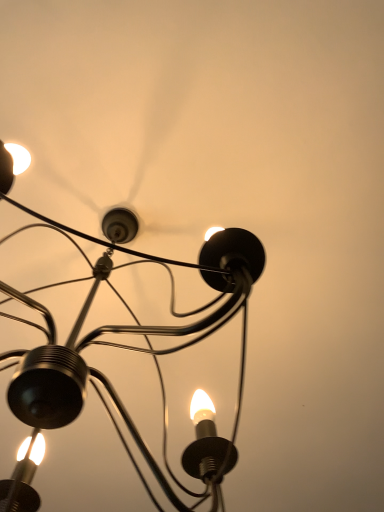
The image size is (384, 512). Describe the element at coordinates (124, 348) in the screenshot. I see `matte black chandelier at upper left` at that location.

Locate an element on the screen. Image resolution: width=384 pixels, height=512 pixels. matte black chandelier at upper left is located at coordinates click(x=124, y=348).

Find the location of `matte black chandelier at upper left`. matte black chandelier at upper left is located at coordinates (124, 348).